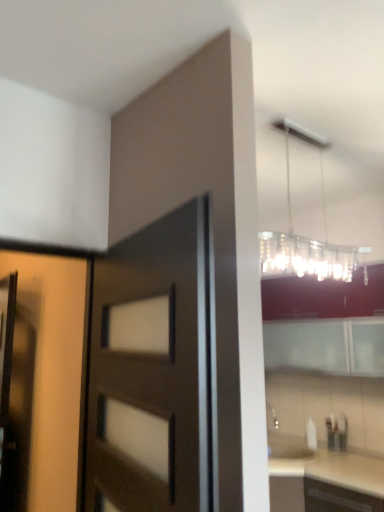
Question: Considering the relative sizes of matte wood door at left, acting as the second door starting from the right, and matte brown screen door at left in the image provided, is matte wood door at left, acting as the second door starting from the right, shorter than matte brown screen door at left?

Choices:
 (A) yes
 (B) no

Answer: (A)

Question: Is matte wood door at left, acting as the second door starting from the right, at the right side of matte brown screen door at left?

Choices:
 (A) yes
 (B) no

Answer: (A)

Question: Does matte wood door at left, placed as the 1th door when sorted from left to right, have a lesser width compared to matte brown screen door at left?

Choices:
 (A) yes
 (B) no

Answer: (A)

Question: Is matte wood door at left, placed as the 1th door when sorted from left to right, positioned with its back to matte brown screen door at left?

Choices:
 (A) no
 (B) yes

Answer: (B)

Question: Is matte wood door at left, placed as the 1th door when sorted from left to right, smaller than matte brown screen door at left?

Choices:
 (A) yes
 (B) no

Answer: (A)

Question: Is clear glass chandelier at upper right situated inside matte wood door at left, placed as the 1th door when sorted from left to right, or outside?

Choices:
 (A) inside
 (B) outside

Answer: (B)

Question: From the image's perspective, is clear glass chandelier at upper right positioned above or below matte wood door at left, placed as the 1th door when sorted from left to right?

Choices:
 (A) above
 (B) below

Answer: (A)

Question: Considering the positions of clear glass chandelier at upper right and matte wood door at left, acting as the second door starting from the right, in the image, is clear glass chandelier at upper right bigger or smaller than matte wood door at left, acting as the second door starting from the right,?

Choices:
 (A) big
 (B) small

Answer: (A)

Question: Is clear glass chandelier at upper right wider or thinner than matte wood door at left, acting as the second door starting from the right?

Choices:
 (A) wide
 (B) thin

Answer: (A)

Question: From a real-world perspective, is matte brown door at center, marked as the first door in a right-to-left arrangement, above or below white glossy cabinet at upper right?

Choices:
 (A) above
 (B) below

Answer: (B)

Question: Is matte brown door at center, which ranks as the 2th door in left-to-right order, spatially inside white glossy cabinet at upper right, or outside of it?

Choices:
 (A) outside
 (B) inside

Answer: (A)

Question: Considering the positions of matte brown door at center, which ranks as the 2th door in left-to-right order, and white glossy cabinet at upper right in the image, is matte brown door at center, which ranks as the 2th door in left-to-right order, wider or thinner than white glossy cabinet at upper right?

Choices:
 (A) thin
 (B) wide

Answer: (A)

Question: Considering the positions of point (213, 458) and point (281, 309), is point (213, 458) closer or farther from the camera than point (281, 309)?

Choices:
 (A) closer
 (B) farther

Answer: (A)

Question: From their relative heights in the image, would you say matte brown door at center, marked as the first door in a right-to-left arrangement, is taller or shorter than matte wood door at left, acting as the second door starting from the right?

Choices:
 (A) short
 (B) tall

Answer: (B)

Question: Looking at the image, does matte brown door at center, which ranks as the 2th door in left-to-right order, seem bigger or smaller compared to matte wood door at left, acting as the second door starting from the right?

Choices:
 (A) small
 (B) big

Answer: (B)